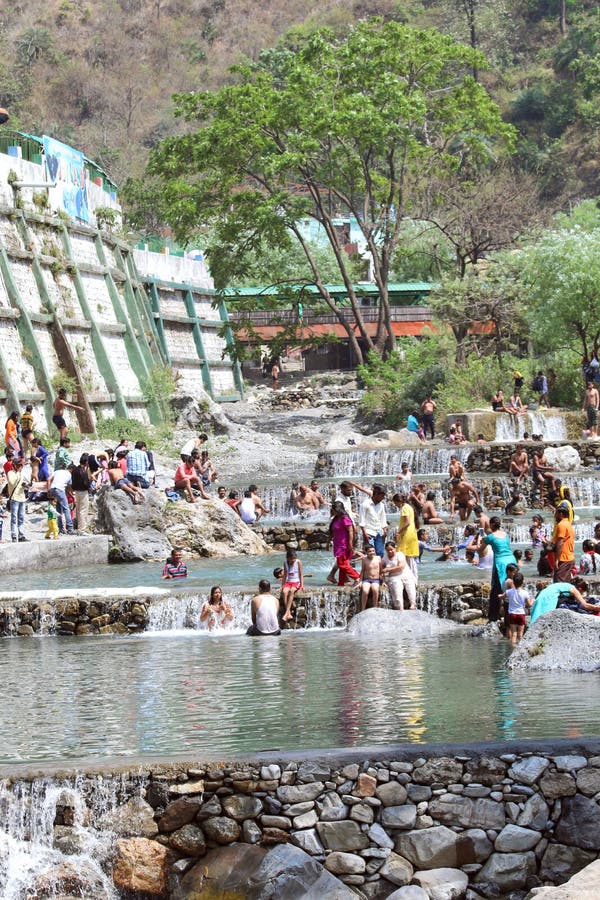
This screenshot has height=900, width=600. What are the coordinates of `door` in the screenshot? It's located at (342, 352), (361, 342).